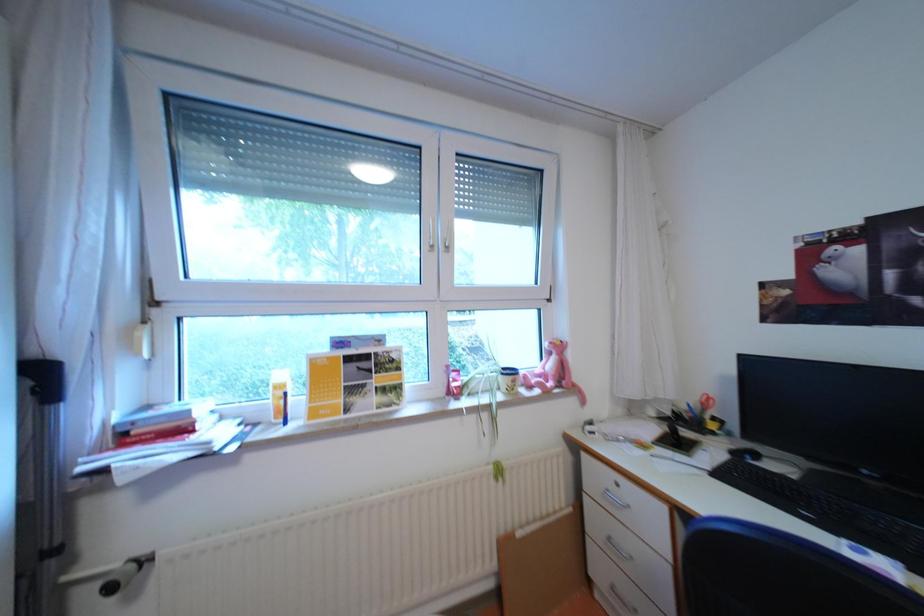
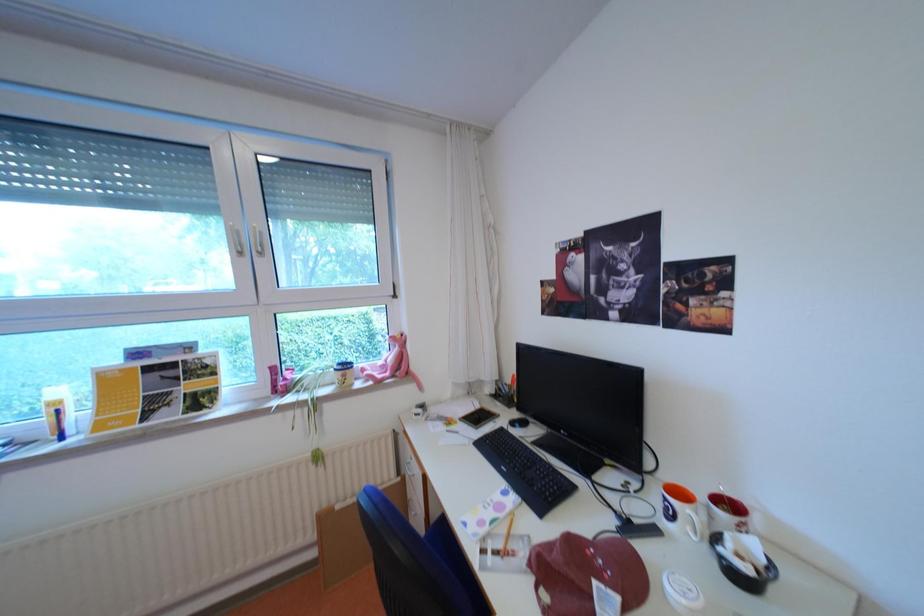
Question: The camera is either moving clockwise (left) or counter-clockwise (right) around the object. The first image is from the beginning of the video and the second image is from the end. Is the camera moving left or right when shooting the video?

Choices:
 (A) Left
 (B) Right

Answer: (A)